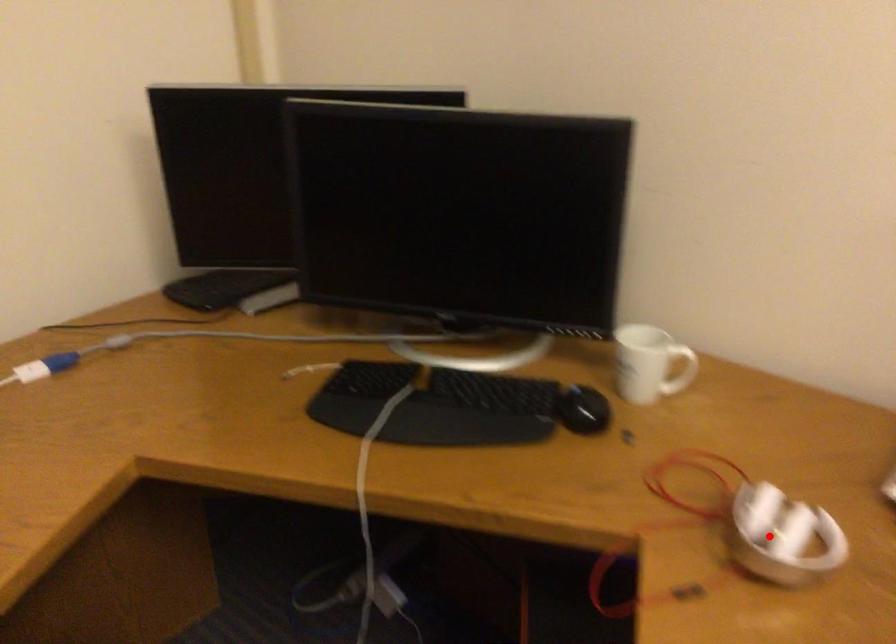
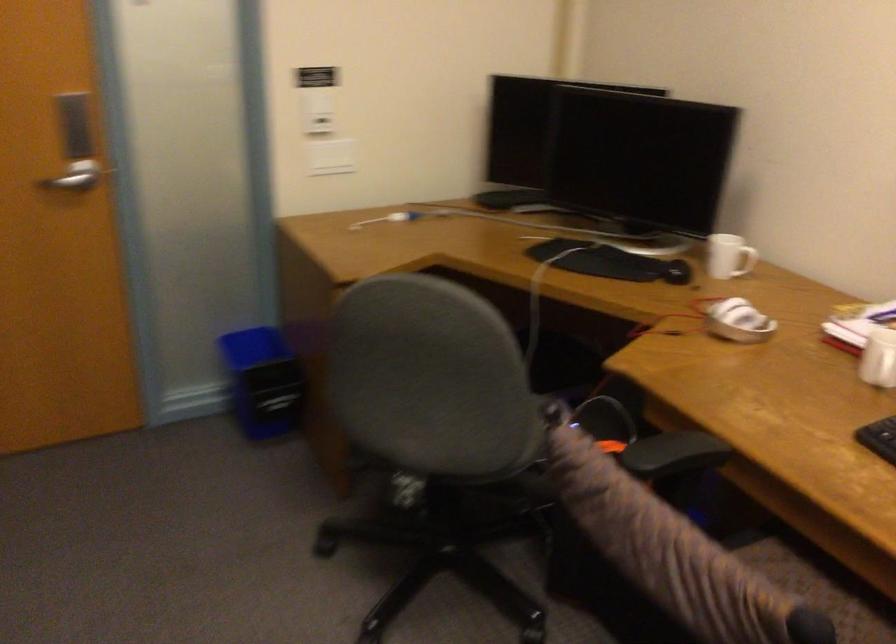
Question: I am providing you with two images of the same scene from different viewpoints. Image1 has a red point marked. In image2, the corresponding 3D location appears at what relative position? Reply with the corresponding letter.

Choices:
 (A) Closer
 (B) Farther

Answer: (B)